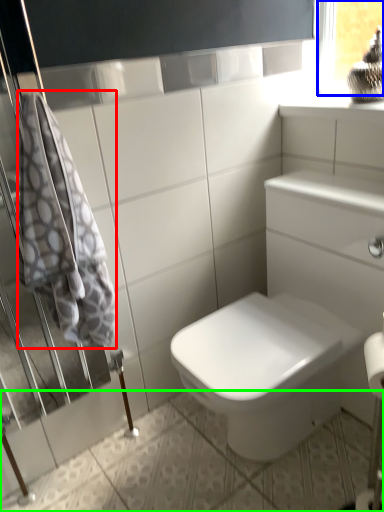
Question: Which is farther away from bath towel (highlighted by a red box)? window frame (highlighted by a blue box) or ceramic tile (highlighted by a green box)?

Choices:
 (A) window frame
 (B) ceramic tile

Answer: (A)